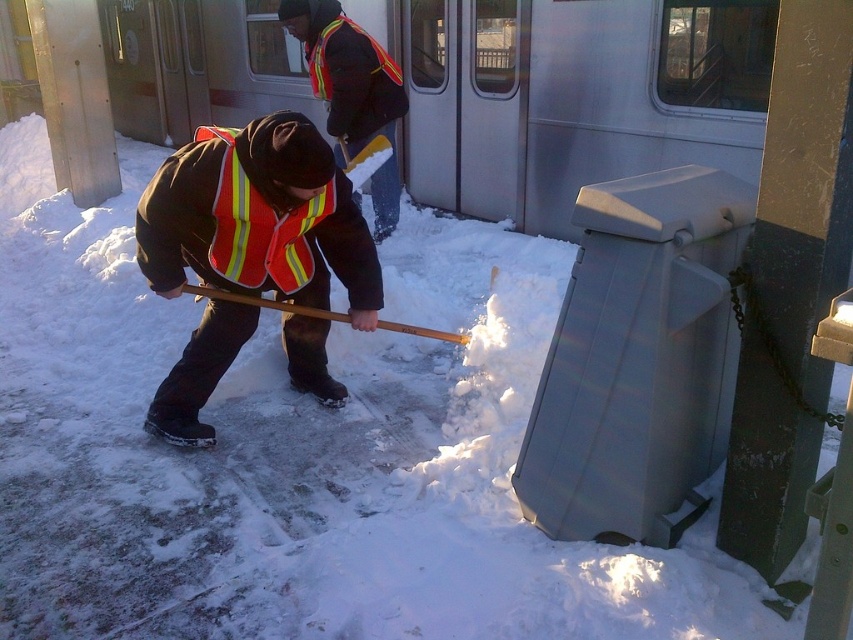
Can you confirm if reflective orange safety vest at center is positioned to the right of reflective fabric safety vest at center?

No, reflective orange safety vest at center is not to the right of reflective fabric safety vest at center.

Which is more to the right, reflective orange safety vest at center or reflective fabric safety vest at center?

reflective fabric safety vest at center

Measure the distance between reflective orange safety vest at center and camera.

reflective orange safety vest at center and camera are 2.48 meters apart.

Locate an element on the screen. reflective orange safety vest at center is located at coordinates (258, 218).

Can you confirm if reflective safety vest at center is wider than reflective fabric safety vest at center?

Indeed, reflective safety vest at center has a greater width compared to reflective fabric safety vest at center.

Is point (386, 166) farther from viewer compared to point (233, 272)?

Yes, point (386, 166) is behind point (233, 272).

Locate an element on the screen. This screenshot has height=640, width=853. reflective safety vest at center is located at coordinates (352, 92).

Between point (250, 148) and point (338, 116), which one is positioned behind?

The point (338, 116) is more distant.

Between point (198, 189) and point (300, 33), which one is positioned in front?

Point (198, 189)

Does point (254, 314) lie in front of point (361, 113)?

Yes, point (254, 314) is in front of point (361, 113).

You are a GUI agent. You are given a task and a screenshot of the screen. Output one action in this format:
    pyautogui.click(x=<x>, y=<y>)
    Task: Click on the reflective orange safety vest at center
    
    Given the screenshot: What is the action you would take?
    pyautogui.click(x=258, y=218)